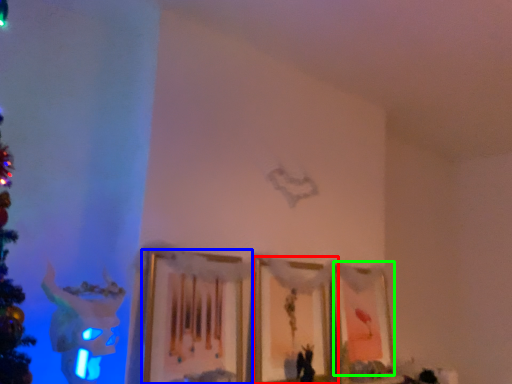
Question: Which is farther away from picture frame (highlighted by a red box)? picture frame (highlighted by a blue box) or picture frame (highlighted by a green box)?

Choices:
 (A) picture frame
 (B) picture frame

Answer: (A)